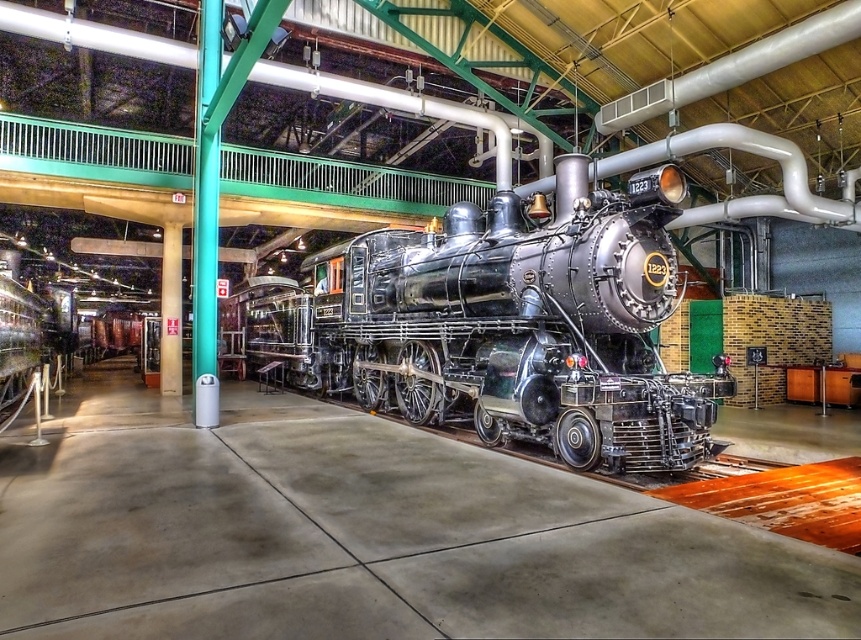
You are standing at the entrance of the museum and see the vintage steam locomotive. There is a teal glossy pole at center located at point (206,218). Can you walk directly towards the locomotive without passing near the pole?

The teal glossy pole at center is located at point (206,218), so you can walk directly towards the locomotive without passing near the pole since it is positioned at the center.